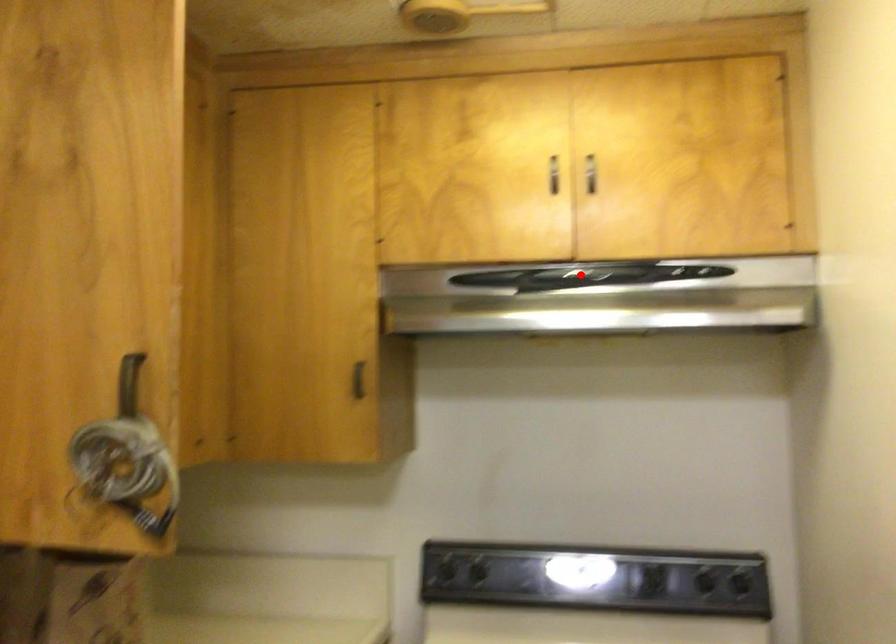
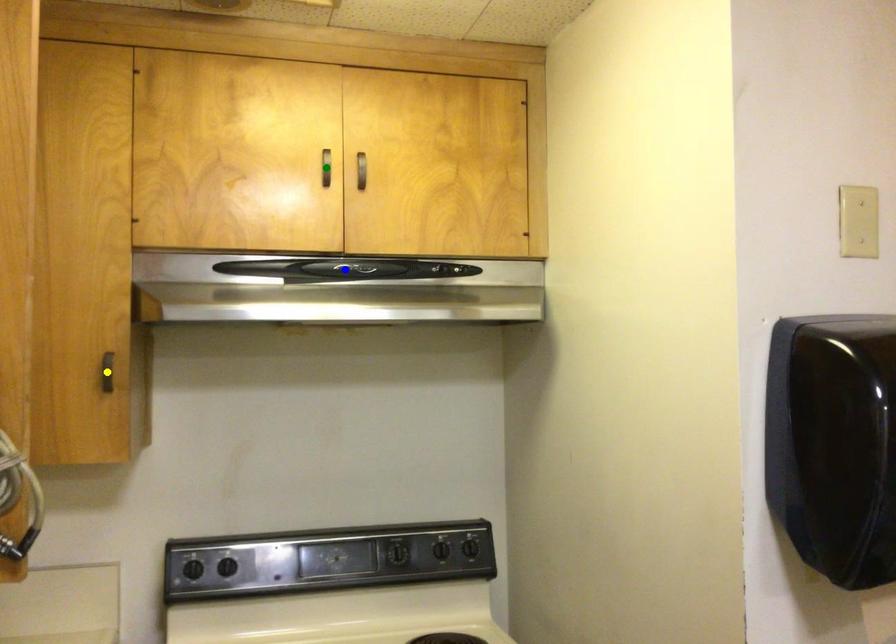
Question: I am providing you with two images of the same scene from different viewpoints. A red point is marked on the first image. You are given multiple points on the second image. In image 2, which mark is for the same physical point as the one in image 1?

Choices:
 (A) green point
 (B) yellow point
 (C) blue point

Answer: (C)